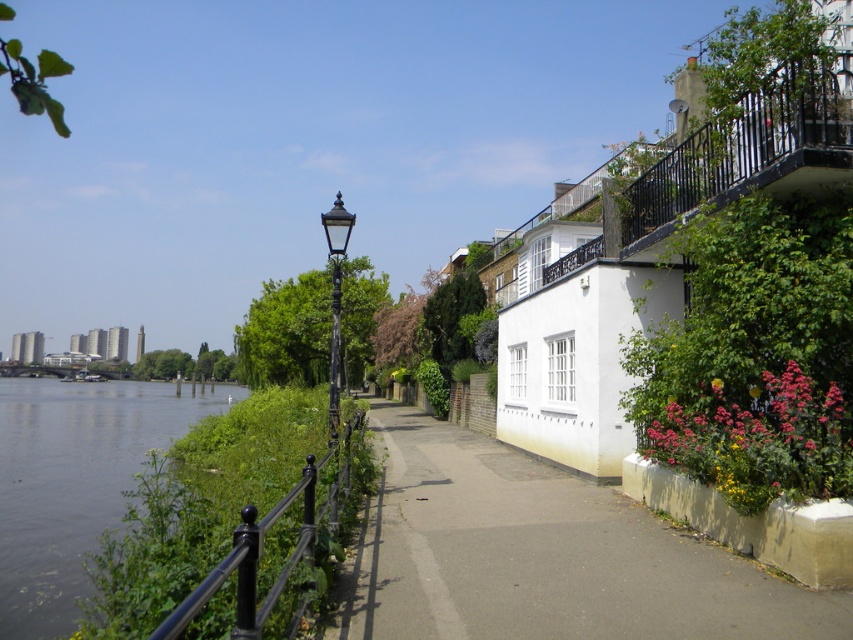
You are standing at the center of the pathway on the riverside. You want to take a photo of the vivid pink petals at lower right. Where should you position yourself to capture the petals in the foreground of your photo?

To capture the vivid pink petals at lower right in the foreground, position yourself closer to the petals. Since they are located at point (761, 444), moving towards that coordinate will place them in the front of the photo.

You are a gardener who wants to plant more flowers near the pathway. Considering the space available for the vivid pink petals at lower right and the black polished metal streetlight at center, which area would allow for more flowers to be planted?

The vivid pink petals at lower right occupies less space than the black polished metal streetlight at center, so the area near the black polished metal streetlight at center would allow for more flowers to be planted since it has more space available.